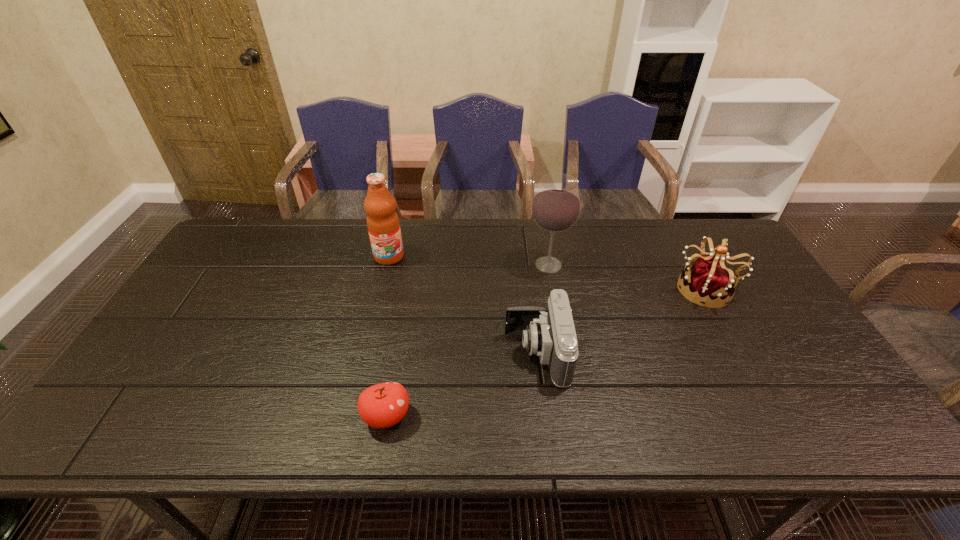
This screenshot has height=540, width=960. I want to click on alcohol, so click(x=556, y=206).

You are a GUI agent. You are given a task and a screenshot of the screen. Output one action in this format:
    pyautogui.click(x=<x>, y=<y>)
    Task: Click on the fruit juice
    
    Given the screenshot: What is the action you would take?
    pyautogui.click(x=383, y=224)

Identify the location of tiara. (708, 282).

Locate an element on the screen. The width and height of the screenshot is (960, 540). the rightmost object is located at coordinates (x=708, y=282).

Find the location of a particular element. camera is located at coordinates (549, 333).

Identify the location of the second nearest object. (549, 333).

Locate an element on the screen. the shortest object is located at coordinates (383, 405).

Locate an element on the screen. This screenshot has width=960, height=540. the nearest object is located at coordinates tap(383, 405).

Find the location of a particular element. vacant space located on the right of the alcohol is located at coordinates (649, 265).

The image size is (960, 540). Identify the location of vacant region located 0.400m on the front label of the fruit juice. (362, 370).